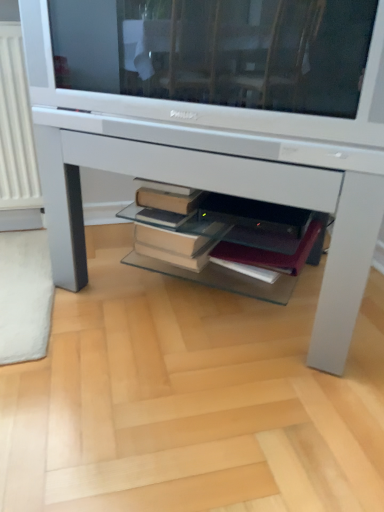
Question: In the image, is maroon leather notebook at center positioned in front of or behind white glossy television at upper center?

Choices:
 (A) front
 (B) behind

Answer: (B)

Question: In terms of size, does maroon leather notebook at center appear bigger or smaller than white glossy television at upper center?

Choices:
 (A) big
 (B) small

Answer: (B)

Question: Which is nearer to the white glossy television at upper center?

Choices:
 (A) maroon leather notebook at center
 (B) white glossy desk at center

Answer: (B)

Question: Estimate the real-world distances between objects in this image. Which object is farther from the maroon leather notebook at center?

Choices:
 (A) white glossy television at upper center
 (B) white glossy desk at center

Answer: (A)